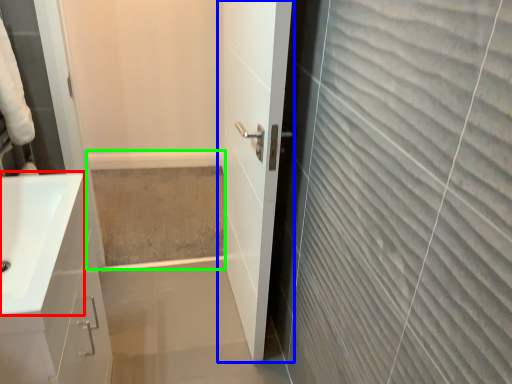
Question: Which is nearer to the sink (highlighted by a red box)? door (highlighted by a blue box) or bath (highlighted by a green box).

Choices:
 (A) door
 (B) bath

Answer: (A)